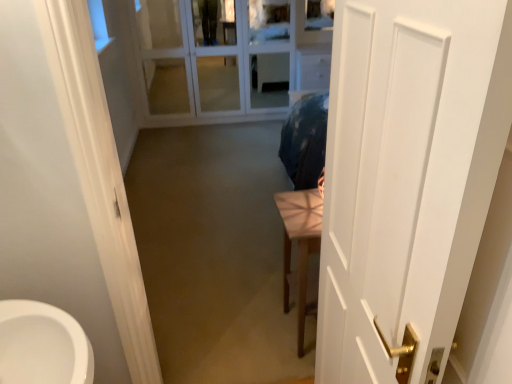
At what (x,y) coordinates should I click in order to perform the action: click on white matte door at right. Please return your answer as a coordinate pair (x, y). This screenshot has width=512, height=384. Looking at the image, I should click on coord(408,177).

From the image's perspective, who appears lower, white glass door at upper center or light brown wooden table at center?

light brown wooden table at center, from the image's perspective.

Is white glass door at upper center not within light brown wooden table at center?

Absolutely, white glass door at upper center is external to light brown wooden table at center.

Does white glass door at upper center turn towards light brown wooden table at center?

Yes, white glass door at upper center is aimed at light brown wooden table at center.

You are a GUI agent. You are given a task and a screenshot of the screen. Output one action in this format:
    pyautogui.click(x=<x>, y=<y>)
    Task: Click on the furniture that appears below the white glass door at upper center (from a real-world perspective)
    The width and height of the screenshot is (512, 384).
    Given the screenshot: What is the action you would take?
    pyautogui.click(x=300, y=246)

Is white glass door at upper center looking in the opposite direction of white matte door at right?

No, white matte door at right is not at the back of white glass door at upper center.

Does white glass door at upper center appear on the right side of white matte door at right?

In fact, white glass door at upper center is to the left of white matte door at right.

Is white glass door at upper center located outside white matte door at right?

Absolutely, white glass door at upper center is external to white matte door at right.

Is point (236, 4) closer or farther from the camera than point (434, 31)?

Clearly, point (236, 4) is more distant from the camera than point (434, 31).

From a real-world perspective, which is physically below, white matte door at right or light brown wooden table at center?

light brown wooden table at center, from a real-world perspective.

Considering their positions, is white matte door at right located in front of or behind light brown wooden table at center?

Visually, white matte door at right is located in front of light brown wooden table at center.

Which of these two, white matte door at right or light brown wooden table at center, is bigger?

light brown wooden table at center is bigger.

Which is behind, point (387, 215) or point (305, 253)?

The point (305, 253) is more distant.

Locate an element on the screen. glass door below the white matte door at right (from a real-world perspective) is located at coordinates (214, 59).

Which is behind, point (328, 353) or point (280, 49)?

Positioned behind is point (280, 49).

Consider the image. From a real-world perspective, is white matte door at right on top of white glass door at upper center?

Yes.

In the scene shown: Is white matte door at right in contact with white glass door at upper center?

No, white matte door at right is not beside white glass door at upper center.

Looking at this image, does light brown wooden table at center contain white matte door at right?

That's incorrect, white matte door at right is not inside light brown wooden table at center.

In the scene shown: How distant is light brown wooden table at center from white matte door at right?

A distance of 29.20 inches exists between light brown wooden table at center and white matte door at right.

Consider the image. Considering the sizes of light brown wooden table at center and white matte door at right in the image, is light brown wooden table at center taller or shorter than white matte door at right?

In the image, light brown wooden table at center appears to be shorter than white matte door at right.

I want to click on furniture beneath the white glass door at upper center (from a real-world perspective), so click(x=300, y=246).

In the scene shown: Is light brown wooden table at center looking in the opposite direction of white glass door at upper center?

No, light brown wooden table at center's orientation is not away from white glass door at upper center.

From the picture: Which point is more forward, [322,210] or [280,68]?

The point [322,210] is closer.

Is light brown wooden table at center far away from white glass door at upper center?

light brown wooden table at center is far away from white glass door at upper center.

Identify the location of furniture on the right of white glass door at upper center. This screenshot has width=512, height=384. (300, 246).

Locate an element on the screen. This screenshot has width=512, height=384. glass door on the left of the white matte door at right is located at coordinates (214, 59).

Considering their positions, is white matte door at right positioned closer to white glass door at upper center than light brown wooden table at center?

light brown wooden table at center.

From the image, which object appears to be farther from light brown wooden table at center, white matte door at right or white glass door at upper center?

white glass door at upper center.

Looking at the image, which one is located closer to white matte door at right, light brown wooden table at center or white glass door at upper center?

light brown wooden table at center.

In the scene shown: When comparing their distances from light brown wooden table at center, does white glass door at upper center or white matte door at right seem closer?

white matte door at right lies closer to light brown wooden table at center than the other object.

From the image, which object appears to be farther from white matte door at right, white glass door at upper center or light brown wooden table at center?

white glass door at upper center lies further to white matte door at right than the other object.

When comparing their distances from white glass door at upper center, does light brown wooden table at center or white matte door at right seem further?

white matte door at right lies further to white glass door at upper center than the other object.

Locate an element on the screen. furniture located between white matte door at right and white glass door at upper center in the depth direction is located at coordinates (300, 246).